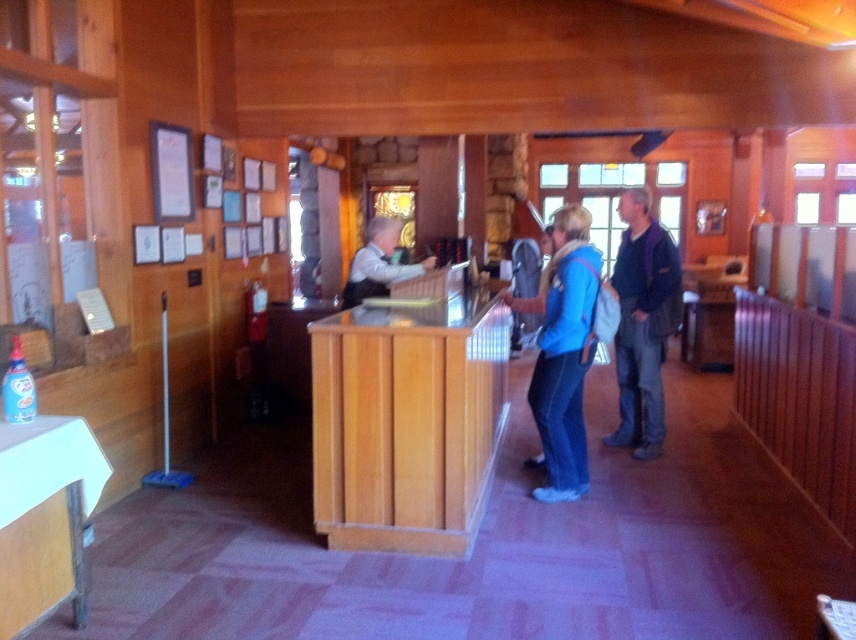
From the picture: You are standing at the entrance of the wooden building and want to approach the wooden counter at center. Based on the coordinates provided, in which direction should you move relative to your current position?

Since the wooden counter at center is located at coordinates point (407, 422), you should move towards the center of the room to reach it.